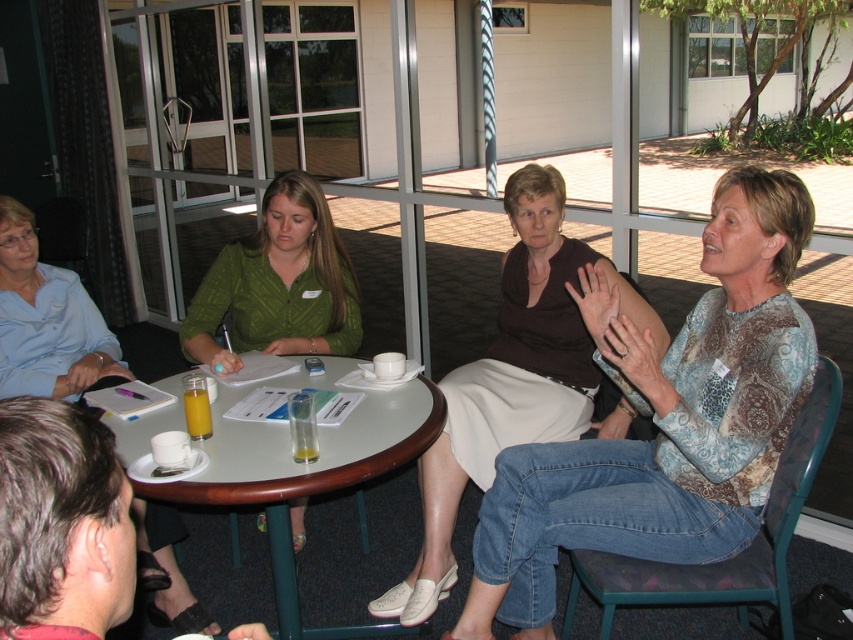
You are sitting at the white glossy table at center and want to hand a document to the person wearing the green textured blouse at center. Since the table is between you and the person, can you still reach them easily?

The white glossy table at center is in front of the green textured blouse at center, so the table is blocking the direct path. You might need to move around the table or pass the document over it to reach the person easily.

You are standing at the entrance of the room and want to know where the patterned fabric blouse at center is located. Based on the coordinate system where the bottom left corner of the room is the origin point, can you determine its position?

The patterned fabric blouse at center is located at point (663, 420).